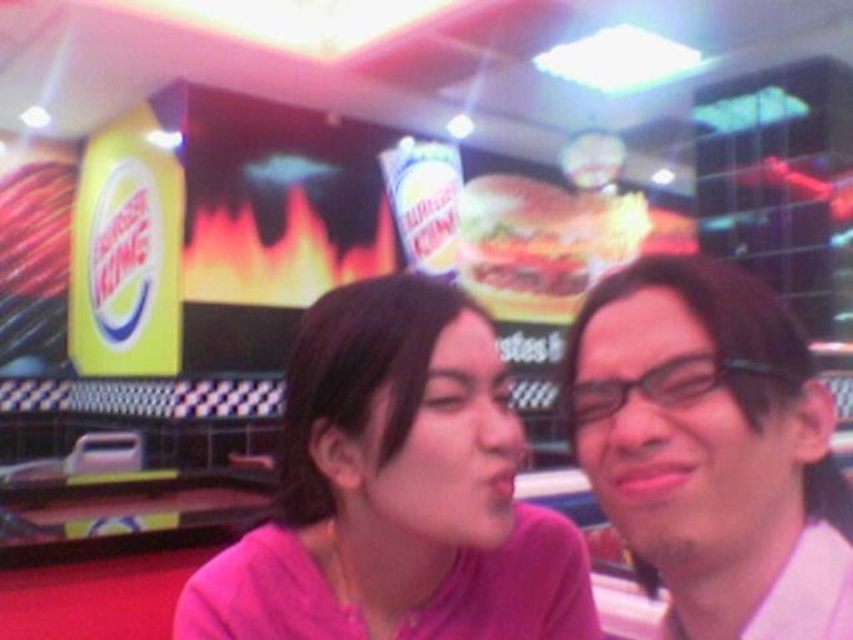
Can you confirm if pink matte shirt at center is positioned to the left of matte white glasses at right?

Yes, pink matte shirt at center is to the left of matte white glasses at right.

Between pink matte shirt at center and matte white glasses at right, which one is positioned higher?

Positioned higher is matte white glasses at right.

Describe the element at coordinates (396, 490) in the screenshot. I see `pink matte shirt at center` at that location.

Locate an element on the screen. Image resolution: width=853 pixels, height=640 pixels. pink matte shirt at center is located at coordinates (396, 490).